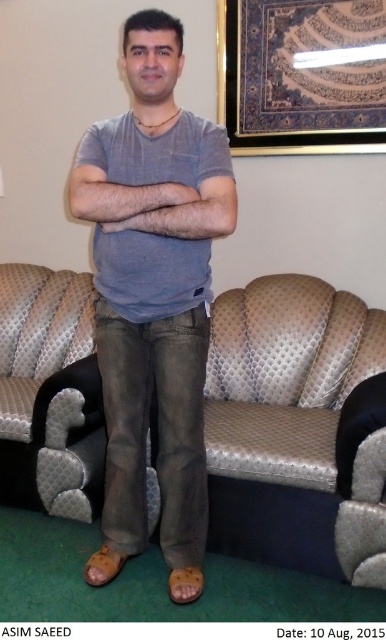
Question: Estimate the real-world distances between objects in this image. Which object is closer to the metallic leather couch at center?

Choices:
 (A) matte gray t-shirt at center
 (B) gold-framed picture at upper center
 (C) matte gray shirt at center

Answer: (A)

Question: Is metallic leather couch at center in front of gold-framed picture at upper center?

Choices:
 (A) yes
 (B) no

Answer: (A)

Question: Is metallic leather couch at center in front of gold-framed picture at upper center?

Choices:
 (A) no
 (B) yes

Answer: (B)

Question: Is matte gray t-shirt at center behind gold-framed picture at upper center?

Choices:
 (A) yes
 (B) no

Answer: (B)

Question: Which point is farther from the camera taking this photo?

Choices:
 (A) (274, 22)
 (B) (196, 220)
 (C) (86, 218)
 (D) (301, 532)

Answer: (A)

Question: Which of the following is the closest to the observer?

Choices:
 (A) matte gray t-shirt at center
 (B) matte gray shirt at center
 (C) gold-framed picture at upper center

Answer: (B)